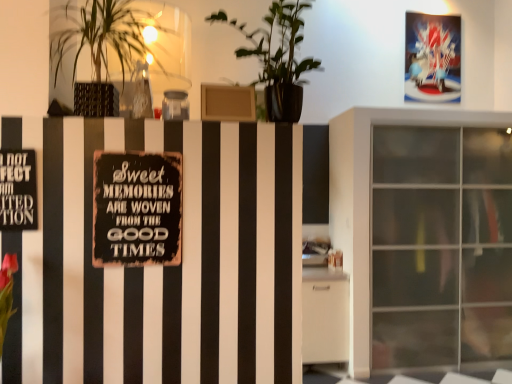
Find the location of a particular element. green matte plant at upper center, the second houseplant viewed from the left is located at coordinates (277, 58).

What do you see at coordinates (18, 190) in the screenshot?
I see `black metal sign at left` at bounding box center [18, 190].

Locate an element on the screen. The width and height of the screenshot is (512, 384). shiny plastic postcard at upper right is located at coordinates 432,58.

Is black metal sign at left looking in the opposite direction of rusty metal sign at center?

black metal sign at left is not turned away from rusty metal sign at center.

From a real-world perspective, is black metal sign at left on rusty metal sign at center?

Yes, from a real-world perspective, black metal sign at left is above rusty metal sign at center.

From the image's perspective, would you say black metal sign at left is shown under rusty metal sign at center?

Incorrect, from the image's perspective, black metal sign at left is higher than rusty metal sign at center.

I want to click on bulletin board below the black metal sign at left (from the image's perspective), so click(x=137, y=209).

Is green leafy plant at upper left, which appears as the second houseplant when viewed from the right, situated inside green matte plant at upper center, the second houseplant viewed from the left, or outside?

green leafy plant at upper left, which appears as the second houseplant when viewed from the right, exists outside the volume of green matte plant at upper center, the second houseplant viewed from the left.

From a real-world perspective, which is physically below, green leafy plant at upper left, which is the first houseplant from left to right, or green matte plant at upper center, which appears as the first houseplant when viewed from the right?

green leafy plant at upper left, which is the first houseplant from left to right, from a real-world perspective.

Is green leafy plant at upper left, which appears as the second houseplant when viewed from the right, oriented away from green matte plant at upper center, the second houseplant viewed from the left?

No, green leafy plant at upper left, which appears as the second houseplant when viewed from the right,'s orientation is not away from green matte plant at upper center, the second houseplant viewed from the left.

Are green leafy plant at upper left, which is the first houseplant from left to right, and green matte plant at upper center, which appears as the first houseplant when viewed from the right, beside each other?

No, green leafy plant at upper left, which is the first houseplant from left to right, is not making contact with green matte plant at upper center, which appears as the first houseplant when viewed from the right.

How different are the orientations of green leafy plant at upper left, which is the first houseplant from left to right, and shiny plastic postcard at upper right in degrees?

The angle between the facing direction of green leafy plant at upper left, which is the first houseplant from left to right, and the facing direction of shiny plastic postcard at upper right is 3.06 degrees.

From the image's perspective, which one is positioned higher, green leafy plant at upper left, which appears as the second houseplant when viewed from the right, or shiny plastic postcard at upper right?

shiny plastic postcard at upper right is shown above in the image.

Is green leafy plant at upper left, which appears as the second houseplant when viewed from the right, to the right of shiny plastic postcard at upper right from the viewer's perspective?

Incorrect, green leafy plant at upper left, which appears as the second houseplant when viewed from the right, is not on the right side of shiny plastic postcard at upper right.

Is green leafy plant at upper left, which is the first houseplant from left to right, positioned behind shiny plastic postcard at upper right?

No, it is not.

The image size is (512, 384). I want to click on the 1st houseplant directly beneath the shiny plastic postcard at upper right (from a real-world perspective), so click(x=277, y=58).

From the image's perspective, which one is positioned lower, green matte plant at upper center, the second houseplant viewed from the left, or shiny plastic postcard at upper right?

From the image's view, green matte plant at upper center, the second houseplant viewed from the left, is below.

Is shiny plastic postcard at upper right surrounded by green matte plant at upper center, the second houseplant viewed from the left?

No, shiny plastic postcard at upper right is located outside of green matte plant at upper center, the second houseplant viewed from the left.

Which of these two, green matte plant at upper center, which appears as the first houseplant when viewed from the right, or shiny plastic postcard at upper right, stands taller?

shiny plastic postcard at upper right.

From a real-world perspective, which is physically above, transparent glass cabinet at right or black metal sign at left?

black metal sign at left is physically above.

Is transparent glass cabinet at right aimed at black metal sign at left?

No, transparent glass cabinet at right is not facing towards black metal sign at left.

Are transparent glass cabinet at right and black metal sign at left beside each other?

transparent glass cabinet at right and black metal sign at left are clearly separated.

From a real-world perspective, which is physically above, black metal sign at left or shiny plastic postcard at upper right?

shiny plastic postcard at upper right is physically above.

Considering the sizes of black metal sign at left and shiny plastic postcard at upper right in the image, is black metal sign at left taller or shorter than shiny plastic postcard at upper right?

In the image, black metal sign at left appears to be shorter than shiny plastic postcard at upper right.

Is black metal sign at left outside of shiny plastic postcard at upper right?

black metal sign at left lies outside shiny plastic postcard at upper right's area.

Which of these two, black metal sign at left or shiny plastic postcard at upper right, is wider?

Wider between the two is shiny plastic postcard at upper right.

Does rusty metal sign at center come in front of transparent glass cabinet at right?

Yes, it is in front of transparent glass cabinet at right.

From the picture: Is rusty metal sign at center not inside transparent glass cabinet at right?

That's correct, rusty metal sign at center is outside of transparent glass cabinet at right.

From the image's perspective, which object appears higher, rusty metal sign at center or transparent glass cabinet at right?

rusty metal sign at center, from the image's perspective.

Is rusty metal sign at center to the left of transparent glass cabinet at right from the viewer's perspective?

Indeed, rusty metal sign at center is positioned on the left side of transparent glass cabinet at right.

Locate an element on the screen. This screenshot has width=512, height=384. warning sign above the rusty metal sign at center (from the image's perspective) is located at coordinates point(18,190).

In the image, there is a green matte plant at upper center, which appears as the first houseplant when viewed from the right. Where is `houseplant below it (from a real-world perspective)`? houseplant below it (from a real-world perspective) is located at coordinates (98, 49).

Which object lies nearer to the anchor point rusty metal sign at center, green leafy plant at upper left, which appears as the second houseplant when viewed from the right, or shiny plastic postcard at upper right?

The object closer to rusty metal sign at center is green leafy plant at upper left, which appears as the second houseplant when viewed from the right.

Based on their spatial positions, is black metal sign at left or green leafy plant at upper left, which is the first houseplant from left to right, closer to green matte plant at upper center, the second houseplant viewed from the left?

Among the two, green leafy plant at upper left, which is the first houseplant from left to right, is located nearer to green matte plant at upper center, the second houseplant viewed from the left.

From the image, which object appears to be nearer to green matte plant at upper center, the second houseplant viewed from the left, black metal sign at left or transparent glass cabinet at right?

black metal sign at left.

When comparing their distances from shiny plastic postcard at upper right, does green leafy plant at upper left, which is the first houseplant from left to right, or green matte plant at upper center, the second houseplant viewed from the left, seem further?

green leafy plant at upper left, which is the first houseplant from left to right, is positioned further to the anchor shiny plastic postcard at upper right.

Estimate the real-world distances between objects in this image. Which object is closer to black metal sign at left, transparent glass cabinet at right or green matte plant at upper center, which appears as the first houseplant when viewed from the right?

green matte plant at upper center, which appears as the first houseplant when viewed from the right, is closer to black metal sign at left.

From the image, which object appears to be farther from green matte plant at upper center, which appears as the first houseplant when viewed from the right, green leafy plant at upper left, which is the first houseplant from left to right, or black metal sign at left?

Among the two, black metal sign at left is located further to green matte plant at upper center, which appears as the first houseplant when viewed from the right.

Consider the image. When comparing their distances from rusty metal sign at center, does green matte plant at upper center, which appears as the first houseplant when viewed from the right, or shiny plastic postcard at upper right seem closer?

green matte plant at upper center, which appears as the first houseplant when viewed from the right, is positioned closer to the anchor rusty metal sign at center.

When comparing their distances from rusty metal sign at center, does green leafy plant at upper left, which is the first houseplant from left to right, or green matte plant at upper center, which appears as the first houseplant when viewed from the right, seem closer?

green leafy plant at upper left, which is the first houseplant from left to right, lies closer to rusty metal sign at center than the other object.

Identify the location of houseplant positioned between green leafy plant at upper left, which appears as the second houseplant when viewed from the right, and shiny plastic postcard at upper right from near to far. (277, 58).

The height and width of the screenshot is (384, 512). I want to click on warning sign between green leafy plant at upper left, which appears as the second houseplant when viewed from the right, and shiny plastic postcard at upper right, along the z-axis, so click(x=18, y=190).

At what (x,y) coordinates should I click in order to perform the action: click on bulletin board located between green leafy plant at upper left, which is the first houseplant from left to right, and shiny plastic postcard at upper right in the depth direction. Please return your answer as a coordinate pair (x, y). Image resolution: width=512 pixels, height=384 pixels. Looking at the image, I should click on (137, 209).

You are a GUI agent. You are given a task and a screenshot of the screen. Output one action in this format:
    pyautogui.click(x=<x>, y=<y>)
    Task: Click on the window positioned between rusty metal sign at center and shiny plastic postcard at upper right from near to far
    This screenshot has height=384, width=512.
    Given the screenshot: What is the action you would take?
    pyautogui.click(x=370, y=199)